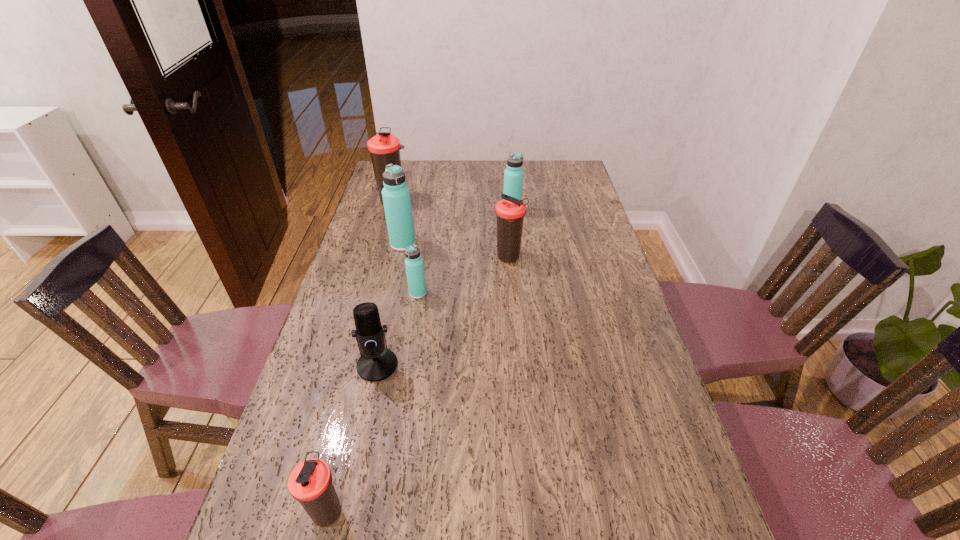
You are a GUI agent. You are given a task and a screenshot of the screen. Output one action in this format:
    pyautogui.click(x=<x>, y=<y>)
    Task: Click on the nearest aqua thermos bottle
    
    Given the screenshot: What is the action you would take?
    pyautogui.click(x=414, y=265)

What are the coordinates of `the nearest brown thermos bottle` in the screenshot? It's located at (311, 482).

Find the location of `the nearest thermos bottle`. the nearest thermos bottle is located at coordinates (311, 482).

Where is `free space located 0.350m on the right of the farthest brown thermos bottle`? free space located 0.350m on the right of the farthest brown thermos bottle is located at coordinates (498, 200).

Image resolution: width=960 pixels, height=540 pixels. Identify the location of vacant space situated 0.390m on the right of the leftmost aqua thermos bottle. (526, 244).

Where is `vacant space located on the left of the second biggest brown thermos bottle`? The height and width of the screenshot is (540, 960). vacant space located on the left of the second biggest brown thermos bottle is located at coordinates (385, 258).

Find the location of `free space located on the front of the farthest aqua thermos bottle`. free space located on the front of the farthest aqua thermos bottle is located at coordinates (515, 241).

This screenshot has width=960, height=540. I want to click on vacant space located on the stand of the sixth farthest object, so click(x=360, y=445).

Identify the location of free space located on the right of the third thermos bottle from right to left. (481, 293).

Find the location of a particular element. This screenshot has width=960, height=540. vacant space located on the right of the nearest brown thermos bottle is located at coordinates (545, 512).